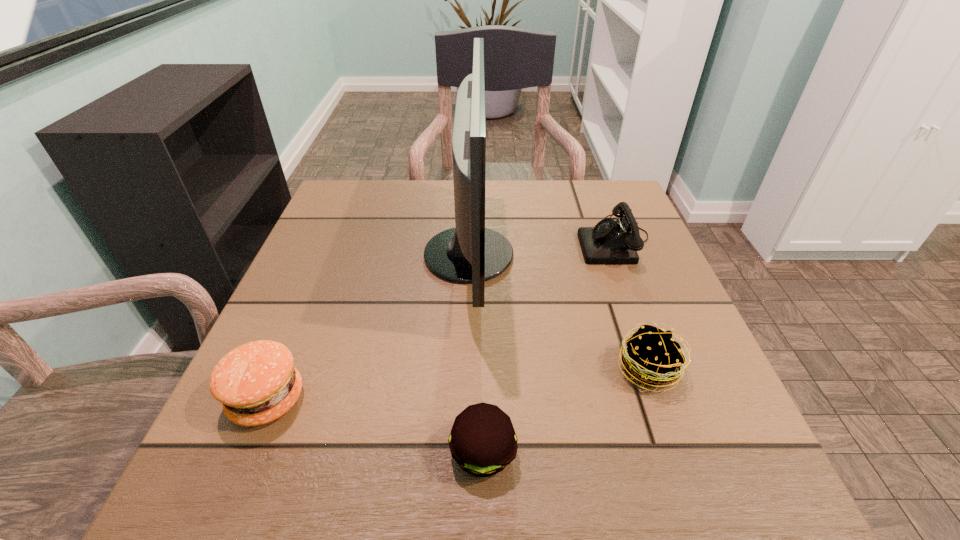
Locate an element on the screen. This screenshot has width=960, height=540. the tallest object is located at coordinates (469, 253).

The image size is (960, 540). In order to click on telephone in this screenshot , I will do `click(610, 242)`.

This screenshot has width=960, height=540. I want to click on the leftmost object, so click(257, 383).

I want to click on the rightmost patty, so click(x=653, y=357).

This screenshot has width=960, height=540. I want to click on the second patty from right to left, so click(x=482, y=441).

This screenshot has height=540, width=960. Find the location of `free space located on the screen side of the monitor`. free space located on the screen side of the monitor is located at coordinates (606, 255).

At what (x,y) coordinates should I click in order to perform the action: click on vacant point located 0.050m on the front face of the telephone. Please return your answer as a coordinate pair (x, y). Looking at the image, I should click on (557, 241).

Identify the location of vacant space situated on the front face of the telephone. Image resolution: width=960 pixels, height=540 pixels. (525, 241).

Find the location of a particular element. The image size is (960, 540). vacant space located 0.160m on the front face of the telephone is located at coordinates (508, 241).

Find the location of a particular element. The height and width of the screenshot is (540, 960). vacant region located 0.060m on the right of the leftmost object is located at coordinates coord(343,400).